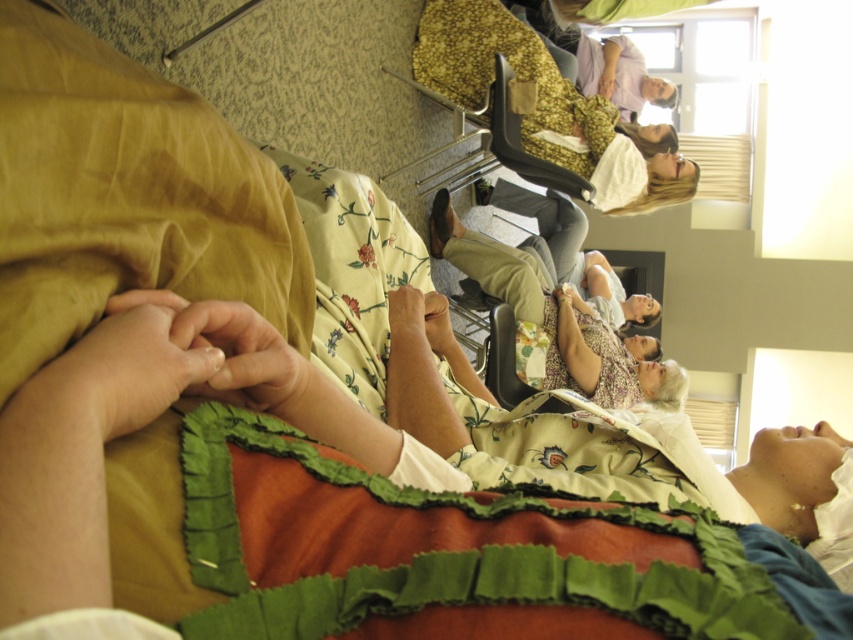
Who is positioned more to the left, floral fabric dress at upper center or floral fabric dress at center?

floral fabric dress at upper center is more to the left.

The image size is (853, 640). I want to click on floral fabric dress at upper center, so click(514, 81).

Between point (448, 36) and point (605, 371), which one is positioned in front?

Positioned in front is point (605, 371).

Where is `floral fabric dress at upper center`? The width and height of the screenshot is (853, 640). floral fabric dress at upper center is located at coordinates (514, 81).